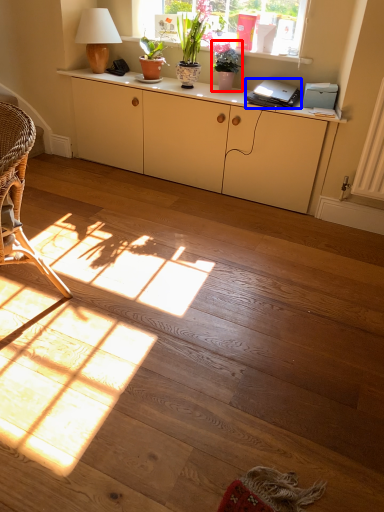
Question: Which of the following is the closest to the observer, houseplant (highlighted by a red box) or laptop (highlighted by a blue box)?

Choices:
 (A) houseplant
 (B) laptop

Answer: (B)